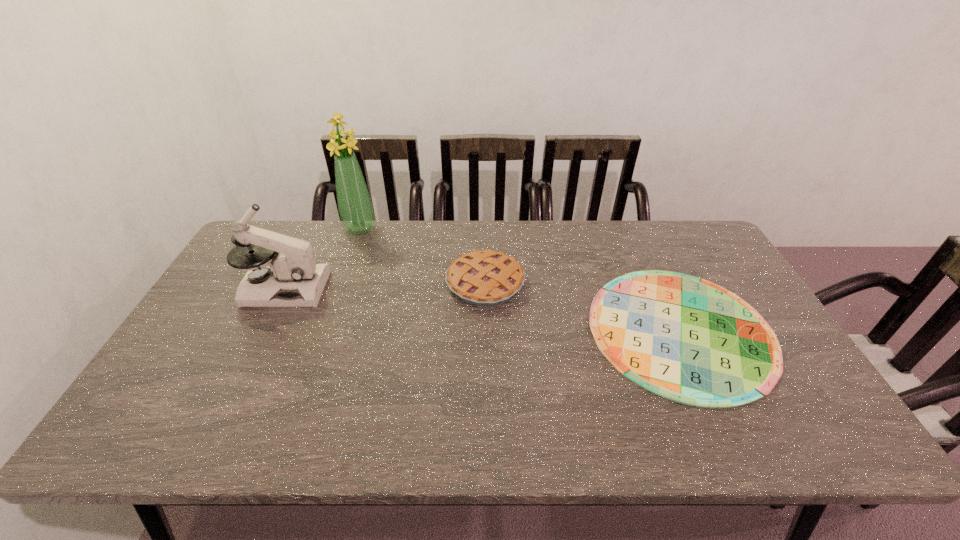
Identify the location of bouquet. (355, 208).

At what (x,y) coordinates should I click in order to perform the action: click on the tallest object. Please return your answer as a coordinate pair (x, y). Image resolution: width=960 pixels, height=540 pixels. Looking at the image, I should click on (355, 208).

Where is `microscope`? This screenshot has height=540, width=960. microscope is located at coordinates (293, 279).

The image size is (960, 540). I want to click on the third tallest object, so click(486, 278).

Find the location of a particular element. the second object from right to left is located at coordinates (486, 278).

I want to click on gameboard, so click(x=686, y=339).

You are a GUI agent. You are given a task and a screenshot of the screen. Output one action in this format:
    pyautogui.click(x=<x>, y=<y>)
    Task: Click on the shortest object
    
    Given the screenshot: What is the action you would take?
    pyautogui.click(x=686, y=339)

Find the location of a particular element. free point located on the front-facing side of the bouquet is located at coordinates (329, 315).

Locate an element on the screen. vacant area located 0.290m at the eyepiece of the microscope is located at coordinates (420, 288).

You are a GUI agent. You are given a task and a screenshot of the screen. Output one action in this format:
    pyautogui.click(x=<x>, y=<y>)
    Task: Click on the free space located 0.280m on the right of the third tallest object
    Image resolution: width=960 pixels, height=540 pixels.
    Given the screenshot: What is the action you would take?
    pyautogui.click(x=616, y=284)